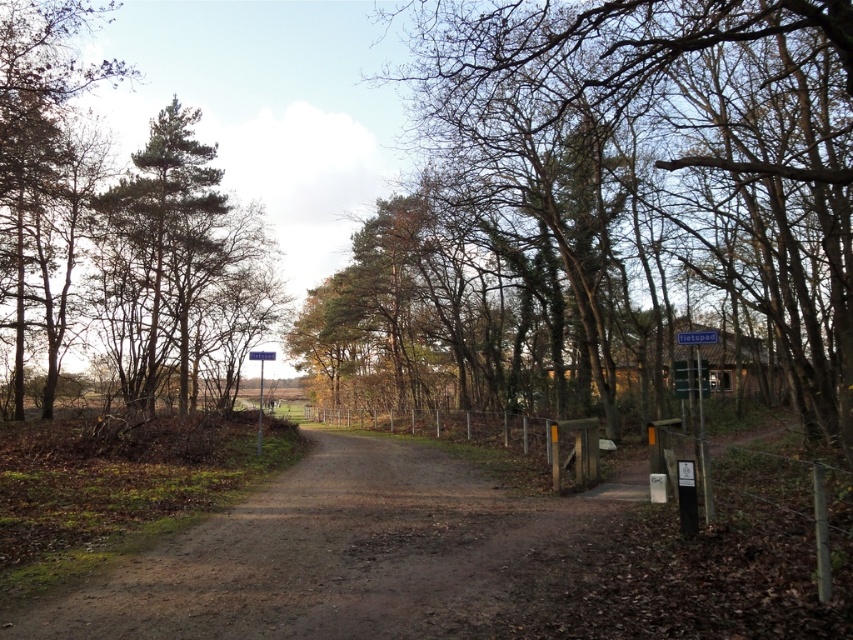
Which is more to the right, bare wood tree at center or green needle-like foliage at left?

bare wood tree at center

The height and width of the screenshot is (640, 853). What do you see at coordinates (680, 138) in the screenshot?
I see `bare wood tree at center` at bounding box center [680, 138].

Is point (850, 280) farther from camera compared to point (144, 284)?

No.

This screenshot has width=853, height=640. I want to click on bare wood tree at center, so click(680, 138).

Who is taller, dirt road at center or green needle-like foliage at left?

green needle-like foliage at left

Can you confirm if dirt road at center is positioned below green needle-like foliage at left?

Indeed, dirt road at center is positioned under green needle-like foliage at left.

This screenshot has height=640, width=853. Identify the location of dirt road at center. (349, 556).

Identify the location of dirt road at center. (349, 556).

Between green needle-like foliage at left and blue plastic street sign at center, which one has more height?

With more height is green needle-like foliage at left.

Consider the image. Does green needle-like foliage at left come behind blue plastic street sign at center?

Yes.

You are a GUI agent. You are given a task and a screenshot of the screen. Output one action in this format:
    pyautogui.click(x=<x>, y=<y>)
    Task: Click on the green needle-like foliage at left
    The image size is (853, 640).
    Given the screenshot: What is the action you would take?
    pyautogui.click(x=169, y=234)